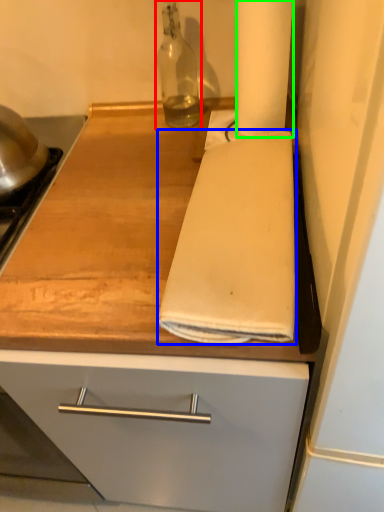
Question: Based on their relative distances, which object is nearer to bottle (highlighted by a red box)? Choose from bath towel (highlighted by a blue box) and paper towel (highlighted by a green box).

Choices:
 (A) bath towel
 (B) paper towel

Answer: (B)